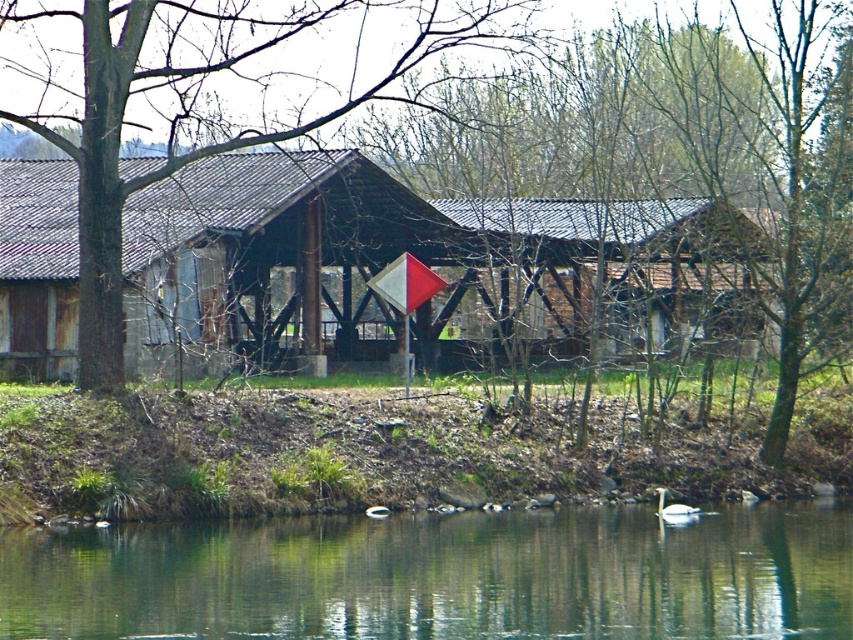
Question: Is green smooth water at lower center positioned behind brown wood tree at center?

Choices:
 (A) yes
 (B) no

Answer: (B)

Question: Which object is closer to the camera taking this photo?

Choices:
 (A) rusty wood barn at center
 (B) white glossy swan at lower center

Answer: (A)

Question: Which is nearer to the rusty wood barn at center?

Choices:
 (A) green smooth water at lower center
 (B) brown wood tree at center

Answer: (B)

Question: Can you confirm if green smooth water at lower center is wider than white glossy swan at lower center?

Choices:
 (A) no
 (B) yes

Answer: (B)

Question: Can you confirm if green smooth water at lower center is smaller than brown wood tree at center?

Choices:
 (A) yes
 (B) no

Answer: (A)

Question: Which object is closer to the camera taking this photo?

Choices:
 (A) white glossy swan at lower center
 (B) green smooth water at lower center
 (C) rusty wood barn at center
 (D) brown wood tree at center

Answer: (B)